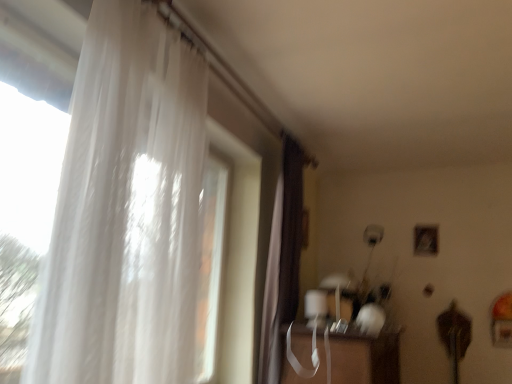
Question: Does translucent white curtain at left, the first curtain when ordered from front to back, have a greater width compared to transparent plastic table at lower center?

Choices:
 (A) yes
 (B) no

Answer: (B)

Question: Is translucent white curtain at left, marked as the first curtain in a left-to-right arrangement, facing away from transparent plastic table at lower center?

Choices:
 (A) no
 (B) yes

Answer: (A)

Question: Can you confirm if translucent white curtain at left, the second curtain viewed from the back, is smaller than transparent plastic table at lower center?

Choices:
 (A) yes
 (B) no

Answer: (A)

Question: Are translucent white curtain at left, the 2th curtain when ordered from right to left, and transparent plastic table at lower center beside each other?

Choices:
 (A) no
 (B) yes

Answer: (A)

Question: Considering the relative positions of translucent white curtain at left, the first curtain when ordered from front to back, and transparent plastic table at lower center in the image provided, is translucent white curtain at left, the first curtain when ordered from front to back, to the right of transparent plastic table at lower center from the viewer's perspective?

Choices:
 (A) yes
 (B) no

Answer: (B)

Question: Visually, is translucent white curtain at left, the 2th curtain when ordered from right to left, positioned to the left or to the right of transparent plastic table at lower center?

Choices:
 (A) left
 (B) right

Answer: (A)

Question: Considering the positions of translucent white curtain at left, the 2th curtain when ordered from right to left, and transparent plastic table at lower center in the image, is translucent white curtain at left, the 2th curtain when ordered from right to left, taller or shorter than transparent plastic table at lower center?

Choices:
 (A) tall
 (B) short

Answer: (A)

Question: Is point (71, 375) positioned closer to the camera than point (352, 374)?

Choices:
 (A) closer
 (B) farther

Answer: (A)

Question: In the image, is translucent white curtain at left, the 2th curtain when ordered from right to left, positioned in front of or behind transparent plastic table at lower center?

Choices:
 (A) front
 (B) behind

Answer: (A)

Question: Considering the positions of point (300, 231) and point (300, 382), is point (300, 231) closer or farther from the camera than point (300, 382)?

Choices:
 (A) farther
 (B) closer

Answer: (A)

Question: Considering the positions of brown velvet curtain at center, which is the 1th curtain in right-to-left order, and transparent plastic table at lower center in the image, is brown velvet curtain at center, which is the 1th curtain in right-to-left order, taller or shorter than transparent plastic table at lower center?

Choices:
 (A) tall
 (B) short

Answer: (A)

Question: Considering the positions of brown velvet curtain at center, which is the 1th curtain in back-to-front order, and transparent plastic table at lower center in the image, is brown velvet curtain at center, which is the 1th curtain in back-to-front order, wider or thinner than transparent plastic table at lower center?

Choices:
 (A) thin
 (B) wide

Answer: (A)

Question: Would you say brown velvet curtain at center, which is the 1th curtain in right-to-left order, is to the left or to the right of transparent plastic table at lower center in the picture?

Choices:
 (A) right
 (B) left

Answer: (B)

Question: Considering the positions of brown velvet curtain at center, positioned as the 2th curtain in front-to-back order, and translucent white curtain at left, marked as the first curtain in a left-to-right arrangement, in the image, is brown velvet curtain at center, positioned as the 2th curtain in front-to-back order, wider or thinner than translucent white curtain at left, marked as the first curtain in a left-to-right arrangement,?

Choices:
 (A) wide
 (B) thin

Answer: (B)

Question: From the image's perspective, is brown velvet curtain at center, arranged as the second curtain when viewed from the left, located above or below translucent white curtain at left, the first curtain when ordered from front to back?

Choices:
 (A) above
 (B) below

Answer: (B)